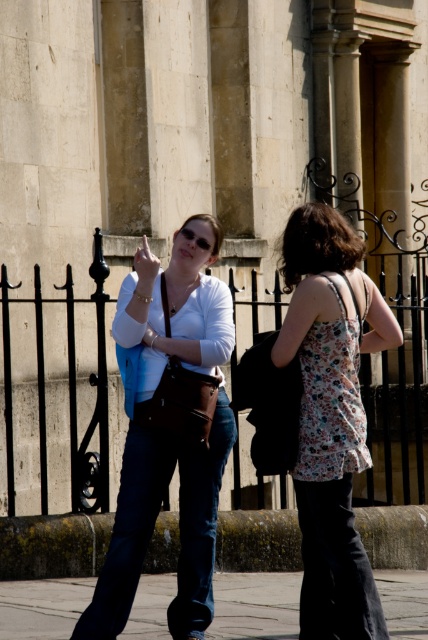
Question: Which of the following is the farthest from the observer?

Choices:
 (A) floral fabric tank top at center
 (B) concrete pavement at lower center
 (C) dark blue denim jeans at lower center

Answer: (C)

Question: Does dark blue denim jeans at center appear on the left side of dark blue denim jeans at lower center?

Choices:
 (A) no
 (B) yes

Answer: (B)

Question: Does dark blue denim jeans at center have a smaller size compared to dark blue denim jeans at lower center?

Choices:
 (A) no
 (B) yes

Answer: (A)

Question: Which object appears farthest from the camera in this image?

Choices:
 (A) concrete pavement at lower center
 (B) dark blue denim jeans at center

Answer: (A)

Question: Can you confirm if dark blue denim jeans at center is wider than concrete pavement at lower center?

Choices:
 (A) no
 (B) yes

Answer: (A)

Question: Which point is farther to the camera?

Choices:
 (A) (348, 424)
 (B) (116, 541)
 (C) (338, 481)
 (D) (154, 577)

Answer: (D)